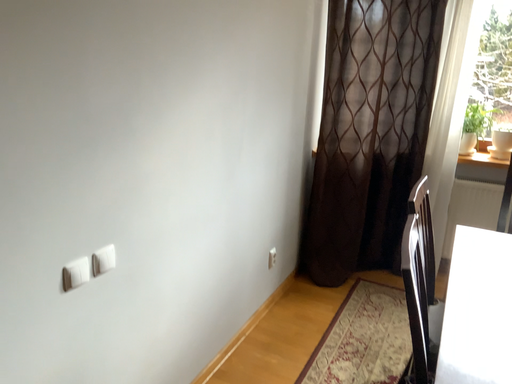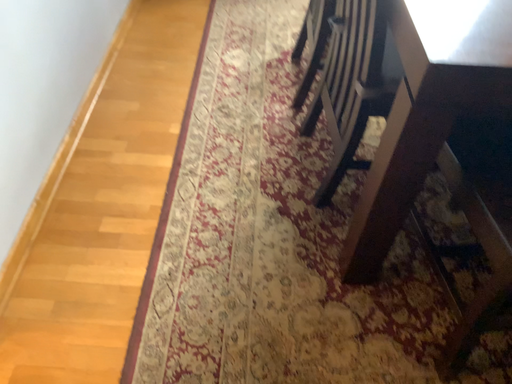
Question: Which way did the camera rotate in the video?

Choices:
 (A) rotated downward
 (B) rotated upward

Answer: (A)